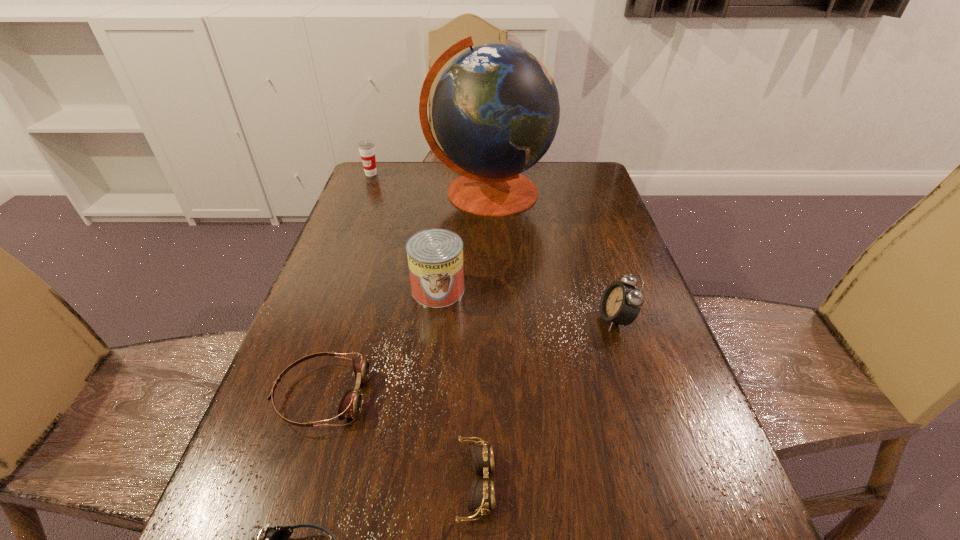
Locate an element on the screen. The width and height of the screenshot is (960, 540). blank space located 0.190m on the face of the rightmost object is located at coordinates (513, 319).

Identify the location of vacant region located 0.190m on the face of the rightmost object. (513, 319).

Identify the location of vacant space positioned on the face of the rightmost object. (426, 319).

Where is `free location located 0.070m through the lenses of the fifth farthest object`? This screenshot has height=540, width=960. free location located 0.070m through the lenses of the fifth farthest object is located at coordinates 403,396.

The image size is (960, 540). I want to click on free space located through the lenses of the second nearest goggles, so click(x=671, y=484).

The image size is (960, 540). I want to click on globe that is at the far edge, so click(x=495, y=110).

At what (x,y) coordinates should I click in order to perform the action: click on cup located in the far edge section of the desktop. Please return your answer as a coordinate pair (x, y). This screenshot has height=540, width=960. Looking at the image, I should click on point(366,148).

Where is `cup present at the left edge`? The width and height of the screenshot is (960, 540). cup present at the left edge is located at coordinates (366, 148).

Find the location of a particular element. The height and width of the screenshot is (540, 960). goggles present at the left edge is located at coordinates (350, 406).

Locate an element on the screen. object situated at the right edge is located at coordinates (620, 303).